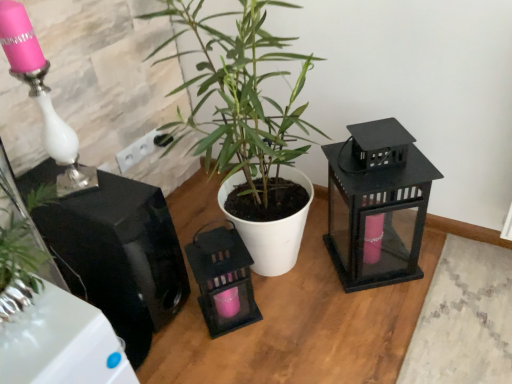
What is the approximate width of green matte plant at center?

19.27 inches.

What do you see at coordinates (244, 118) in the screenshot? The height and width of the screenshot is (384, 512). I see `green matte plant at center` at bounding box center [244, 118].

Image resolution: width=512 pixels, height=384 pixels. Describe the element at coordinates (377, 204) in the screenshot. I see `matte black lantern at right, acting as the first appliance starting from the right` at that location.

The height and width of the screenshot is (384, 512). What are the coordinates of `pink glass table lamp at left` in the screenshot? It's located at (42, 97).

Looking at this image, considering the sizes of objects glossy black speaker at left, which is the 1th appliance in left-to-right order, and green matte plant at center in the image provided, who is shorter, glossy black speaker at left, which is the 1th appliance in left-to-right order, or green matte plant at center?

Standing shorter between the two is glossy black speaker at left, which is the 1th appliance in left-to-right order.

Would you say glossy black speaker at left, which ranks as the 2th appliance in right-to-left order, contains green matte plant at center?

That's incorrect, green matte plant at center is not inside glossy black speaker at left, which ranks as the 2th appliance in right-to-left order.

From a real-world perspective, who is located higher, glossy black speaker at left, which ranks as the 2th appliance in right-to-left order, or green matte plant at center?

From a 3D spatial view, green matte plant at center is above.

Does matte black lantern at right, acting as the 2th appliance starting from the left, have a lesser width compared to glossy black speaker at left, which ranks as the 2th appliance in right-to-left order?

Yes.

Is matte black lantern at right, acting as the 2th appliance starting from the left, positioned behind glossy black speaker at left, which ranks as the 2th appliance in right-to-left order?

Yes, it is behind glossy black speaker at left, which ranks as the 2th appliance in right-to-left order.

Are matte black lantern at right, acting as the 2th appliance starting from the left, and glossy black speaker at left, which ranks as the 2th appliance in right-to-left order, far apart?

No, matte black lantern at right, acting as the 2th appliance starting from the left, is in close proximity to glossy black speaker at left, which ranks as the 2th appliance in right-to-left order.

How much distance is there between matte black lantern at right, acting as the first appliance starting from the right, and glossy black speaker at left, which ranks as the 2th appliance in right-to-left order?

matte black lantern at right, acting as the first appliance starting from the right, and glossy black speaker at left, which ranks as the 2th appliance in right-to-left order, are 23.98 inches apart from each other.

Is green matte plant at center positioned far away from glossy black speaker at left, which is the 1th appliance in left-to-right order?

They are positioned close to each other.

Considering the relative sizes of green matte plant at center and glossy black speaker at left, which ranks as the 2th appliance in right-to-left order, in the image provided, is green matte plant at center shorter than glossy black speaker at left, which ranks as the 2th appliance in right-to-left order,?

Incorrect, the height of green matte plant at center does not fall short of that of glossy black speaker at left, which ranks as the 2th appliance in right-to-left order.

Who is more distant, green matte plant at center or glossy black speaker at left, which is the 1th appliance in left-to-right order?

Positioned behind is glossy black speaker at left, which is the 1th appliance in left-to-right order.

Who is taller, pink glass table lamp at left or white plastic electric outlet at upper center?

With more height is pink glass table lamp at left.

This screenshot has height=384, width=512. What are the coordinates of `electric outlet below the pink glass table lamp at left (from a real-world perspective)` in the screenshot? It's located at (141, 149).

From the image's perspective, is pink glass table lamp at left below white plastic electric outlet at upper center?

Incorrect, from the image's perspective, pink glass table lamp at left is higher than white plastic electric outlet at upper center.

Consider the image. Would you say pink glass table lamp at left is inside or outside white plastic electric outlet at upper center?

pink glass table lamp at left is not inside white plastic electric outlet at upper center, it's outside.

Considering the relative sizes of pink glass table lamp at left and glossy black speaker at left, which is the 1th appliance in left-to-right order, in the image provided, is pink glass table lamp at left taller than glossy black speaker at left, which is the 1th appliance in left-to-right order,?

Correct, pink glass table lamp at left is much taller as glossy black speaker at left, which is the 1th appliance in left-to-right order.

Consider the image. From a real-world perspective, relative to glossy black speaker at left, which ranks as the 2th appliance in right-to-left order, is pink glass table lamp at left vertically above or below?

pink glass table lamp at left is above glossy black speaker at left, which ranks as the 2th appliance in right-to-left order.

Which object is thinner, pink glass table lamp at left or glossy black speaker at left, which is the 1th appliance in left-to-right order?

pink glass table lamp at left is thinner.

Looking at this image, is pink glass table lamp at left placed right next to glossy black speaker at left, which is the 1th appliance in left-to-right order?

pink glass table lamp at left and glossy black speaker at left, which is the 1th appliance in left-to-right order, are clearly separated.

This screenshot has width=512, height=384. What are the coordinates of `electric outlet above the glossy black speaker at left, which ranks as the 2th appliance in right-to-left order (from a real-world perspective)` in the screenshot? It's located at (141, 149).

From the image's perspective, which is below, white plastic electric outlet at upper center or glossy black speaker at left, which ranks as the 2th appliance in right-to-left order?

From the image's view, glossy black speaker at left, which ranks as the 2th appliance in right-to-left order, is below.

Is white plastic electric outlet at upper center wider or thinner than glossy black speaker at left, which is the 1th appliance in left-to-right order?

Clearly, white plastic electric outlet at upper center has less width compared to glossy black speaker at left, which is the 1th appliance in left-to-right order.

Considering the sizes of white plastic electric outlet at upper center and glossy black speaker at left, which ranks as the 2th appliance in right-to-left order, in the image, is white plastic electric outlet at upper center bigger or smaller than glossy black speaker at left, which ranks as the 2th appliance in right-to-left order,?

Considering their sizes, white plastic electric outlet at upper center takes up less space than glossy black speaker at left, which ranks as the 2th appliance in right-to-left order.

Would you consider pink glass table lamp at left to be distant from green matte plant at center?

pink glass table lamp at left is near green matte plant at center, not far away.

Choose the correct answer: Is pink glass table lamp at left inside green matte plant at center or outside it?

pink glass table lamp at left is not inside green matte plant at center, it's outside.

Which of these two, pink glass table lamp at left or green matte plant at center, is thinner?

Thinner between the two is pink glass table lamp at left.

This screenshot has width=512, height=384. I want to click on houseplant on the right of glossy black speaker at left, which is the 1th appliance in left-to-right order, so click(244, 118).

Locate an element on the screen. This screenshot has width=512, height=384. appliance lying behind the glossy black speaker at left, which ranks as the 2th appliance in right-to-left order is located at coordinates (377, 204).

Which object lies nearer to the anchor point matte black lantern at right, acting as the first appliance starting from the right, glossy black speaker at left, which is the 1th appliance in left-to-right order, or white plastic electric outlet at upper center?

glossy black speaker at left, which is the 1th appliance in left-to-right order, is closer to matte black lantern at right, acting as the first appliance starting from the right.

Looking at this image, considering their positions, is pink glass table lamp at left positioned closer to green matte plant at center than glossy black speaker at left, which ranks as the 2th appliance in right-to-left order?

glossy black speaker at left, which ranks as the 2th appliance in right-to-left order, is positioned closer to the anchor green matte plant at center.

Looking at the image, which one is located further to green matte plant at center, pink glass table lamp at left or matte black lantern at right, acting as the 2th appliance starting from the left?

Among the two, pink glass table lamp at left is located further to green matte plant at center.

When comparing their distances from white plastic electric outlet at upper center, does green matte plant at center or pink glass table lamp at left seem closer?

pink glass table lamp at left.

Estimate the real-world distances between objects in this image. Which object is further from green matte plant at center, glossy black speaker at left, which ranks as the 2th appliance in right-to-left order, or white plastic electric outlet at upper center?

white plastic electric outlet at upper center.

Estimate the real-world distances between objects in this image. Which object is further from white plastic electric outlet at upper center, glossy black speaker at left, which is the 1th appliance in left-to-right order, or matte black lantern at right, acting as the 2th appliance starting from the left?

Among the two, matte black lantern at right, acting as the 2th appliance starting from the left, is located further to white plastic electric outlet at upper center.

Considering their positions, is matte black lantern at right, acting as the 2th appliance starting from the left, positioned closer to green matte plant at center than pink glass table lamp at left?

Among the two, matte black lantern at right, acting as the 2th appliance starting from the left, is located nearer to green matte plant at center.

Looking at the image, which one is located closer to glossy black speaker at left, which is the 1th appliance in left-to-right order, matte black lantern at right, acting as the first appliance starting from the right, or green matte plant at center?

The object closer to glossy black speaker at left, which is the 1th appliance in left-to-right order, is green matte plant at center.

The width and height of the screenshot is (512, 384). I want to click on houseplant between pink glass table lamp at left and matte black lantern at right, acting as the 2th appliance starting from the left, from left to right, so (x=244, y=118).

This screenshot has height=384, width=512. Find the location of `appliance between pink glass table lamp at left and matte black lantern at right, acting as the 2th appliance starting from the left, in the horizontal direction`. appliance between pink glass table lamp at left and matte black lantern at right, acting as the 2th appliance starting from the left, in the horizontal direction is located at coordinates tap(119, 256).

The height and width of the screenshot is (384, 512). I want to click on electric outlet between glossy black speaker at left, which ranks as the 2th appliance in right-to-left order, and matte black lantern at right, acting as the 2th appliance starting from the left, so click(141, 149).

At what (x,y) coordinates should I click in order to perform the action: click on electric outlet situated between pink glass table lamp at left and matte black lantern at right, acting as the 2th appliance starting from the left, from left to right. Please return your answer as a coordinate pair (x, y). Looking at the image, I should click on (141, 149).